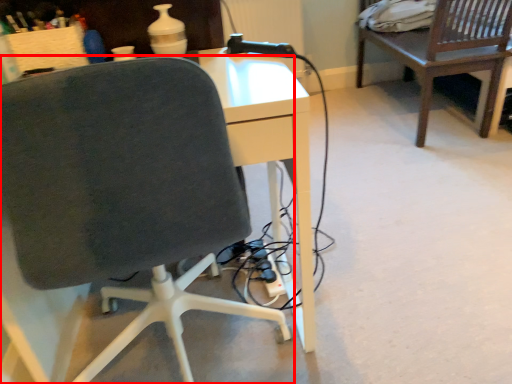
Question: In this image, where is chair (annotated by the red box) located relative to table?

Choices:
 (A) right
 (B) left

Answer: (B)